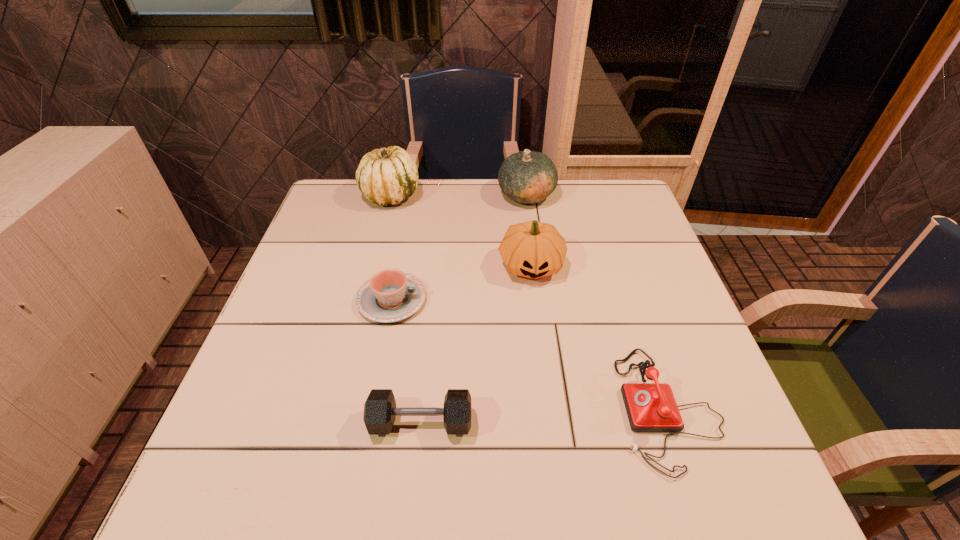
This screenshot has width=960, height=540. Find the location of `the leftmost gourd`. the leftmost gourd is located at coordinates (387, 176).

What are the coordinates of `the nearest gourd` in the screenshot? It's located at (532, 249).

Where is `dumbbell`? dumbbell is located at coordinates (380, 411).

You are a GUI agent. You are given a task and a screenshot of the screen. Output one action in this format:
    pyautogui.click(x=<x>, y=<y>)
    Task: Click on the rightmost object
    Image resolution: width=960 pixels, height=540 pixels.
    Given the screenshot: What is the action you would take?
    pyautogui.click(x=651, y=407)

You are a GUI agent. You are given a task and a screenshot of the screen. Output one action in this format:
    pyautogui.click(x=<x>, y=<y>)
    Task: Click on the chinaware
    This screenshot has height=540, width=960.
    Given the screenshot: What is the action you would take?
    pyautogui.click(x=391, y=295)

You are a GUI agent. You are given a task and a screenshot of the screen. Output one action in this format:
    pyautogui.click(x=<x>, y=<y>)
    Task: Click on the blank space located 0.050m on the left of the leftmost gourd
    
    Given the screenshot: What is the action you would take?
    pyautogui.click(x=345, y=194)

Identify the location of vacant space situated 0.090m on the side of the nearest gourd with the carved face. The height and width of the screenshot is (540, 960). (538, 316).

Identify the location of vacant space located on the right of the dumbbell. (518, 422).

In order to click on vacant space located 0.340m on the dial of the telephone in this screenshot , I will do `click(447, 408)`.

Locate an element on the screen. This screenshot has width=960, height=540. vacant space located 0.360m on the dial of the telephone is located at coordinates (437, 408).